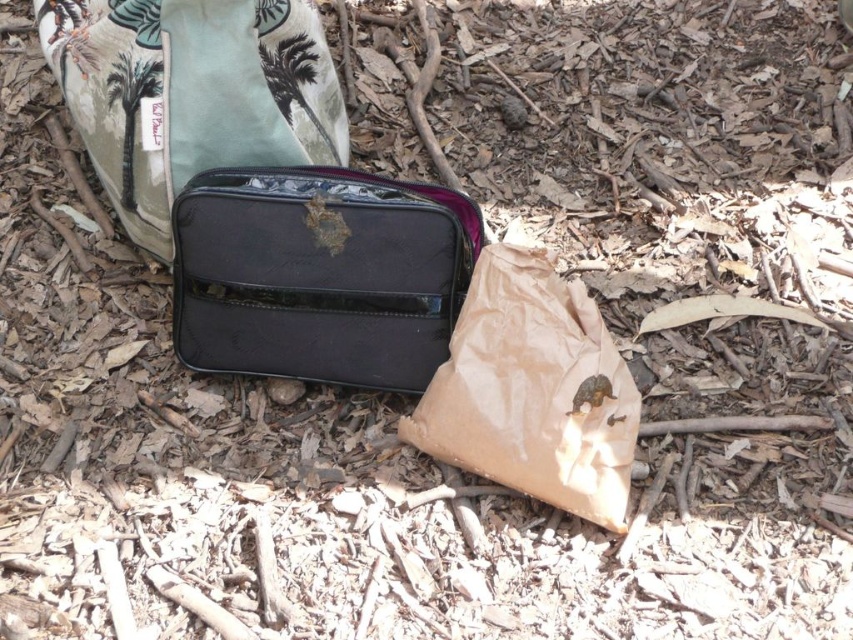
You are a delivery person who needs to place a new package between the glossy black bag at center and the brown paper bag at center. The package is 10 inches long. Can you fit it between them without moving either bag?

The glossy black bag at center and brown paper bag at center are 10.15 inches apart from each other. Since the package is 10 inches long, it can fit between them as there is enough space.

You are standing in a garden with two points marked on the ground. The first point is at coordinates point [171,220] and the second is at point [554,481]. If you want to reach the point that is closer to you, which coordinate should you walk towards?

You should walk towards point [171,220] because it is closer to you than point [554,481].